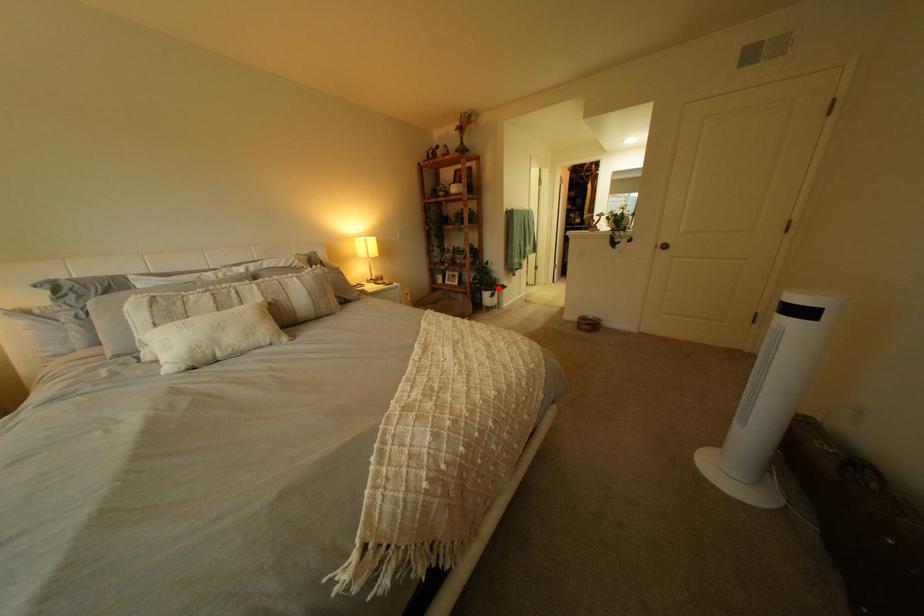
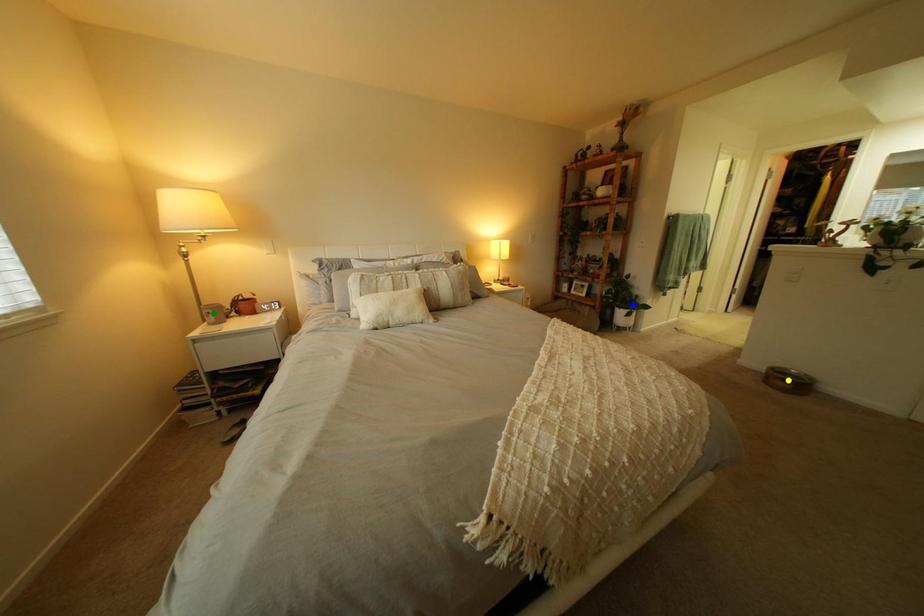
Question: I am providing you with two images of the same scene from different viewpoints. A red point is marked on the first image. You are given multiple points on the second image. Which spot in image 2 lines up with the point in image 1?

Choices:
 (A) green point
 (B) blue point
 (C) yellow point

Answer: (B)